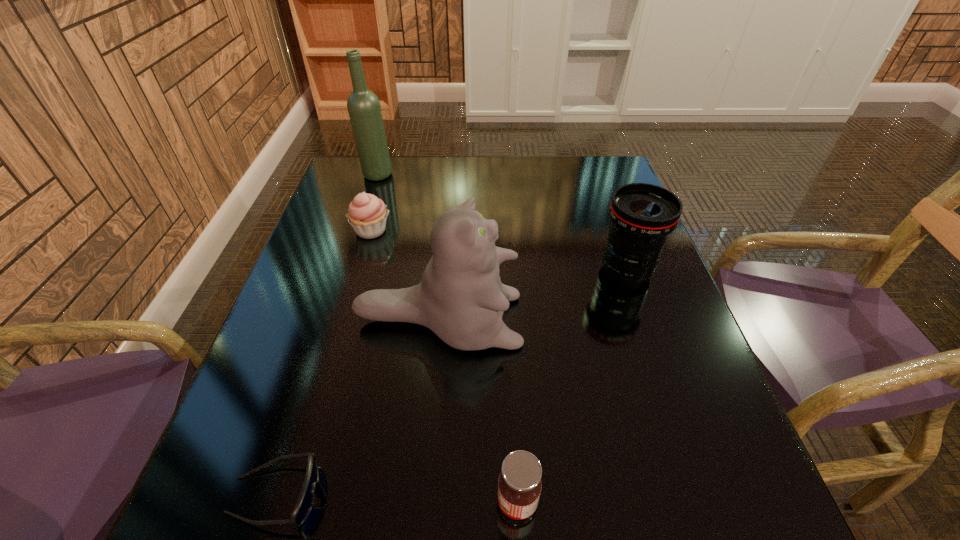
Find the location of a particular element. This screenshot has height=540, width=960. vacant space at the near left corner of the desktop is located at coordinates coord(180,534).

Locate an element on the screen. The width and height of the screenshot is (960, 540). vacant space at the far right corner of the desktop is located at coordinates (592, 179).

You are a GUI agent. You are given a task and a screenshot of the screen. Output one action in this format:
    pyautogui.click(x=<x>, y=<y>)
    Task: Click on the vacant space that is in between the telephoto lens and the sunglasses
    The image size is (960, 540).
    Given the screenshot: What is the action you would take?
    pyautogui.click(x=451, y=383)

The height and width of the screenshot is (540, 960). I want to click on free space that is in between the telephoto lens and the farthest object, so click(x=501, y=223).

Where is `free area in between the fifth shortest object and the tallest object`? This screenshot has width=960, height=540. free area in between the fifth shortest object and the tallest object is located at coordinates (408, 247).

Locate an element on the screen. This screenshot has width=960, height=540. free area in between the second tallest object and the jam is located at coordinates (478, 411).

At what (x,y) coordinates should I click in order to perform the action: click on free space between the cupcake and the jam. Please return your answer as a coordinate pair (x, y). Looking at the image, I should click on (444, 366).

I want to click on empty location between the sunglasses and the rightmost object, so click(x=451, y=383).

The image size is (960, 540). Find the location of `vacant space in between the wine bottle and the sunglasses`. vacant space in between the wine bottle and the sunglasses is located at coordinates (326, 335).

The width and height of the screenshot is (960, 540). What are the coordinates of `free spot between the cat and the cupcake` in the screenshot? It's located at (405, 276).